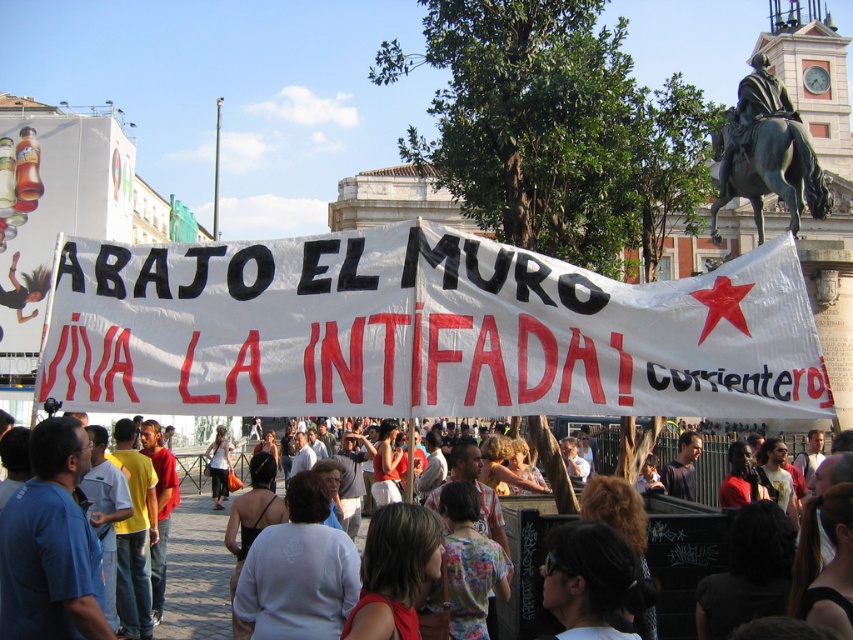
Question: Can you confirm if white cotton shirt at center is positioned to the right of bronze statue of man on horse at upper right?

Choices:
 (A) yes
 (B) no

Answer: (B)

Question: Can you confirm if white paper banner at center is positioned above bronze statue of man on horse at upper right?

Choices:
 (A) yes
 (B) no

Answer: (B)

Question: Which of the following is the farthest from the observer?

Choices:
 (A) white cotton shirt at center
 (B) bronze statue of man on horse at upper right
 (C) white paper banner at center

Answer: (B)

Question: Which point appears farthest from the camera in this image?

Choices:
 (A) (509, 532)
 (B) (477, 344)

Answer: (A)

Question: Which object is the closest to the white paper banner at center?

Choices:
 (A) bronze statue of man on horse at upper right
 (B) white cotton shirt at center

Answer: (B)

Question: Can you confirm if white cotton shirt at center is bigger than bronze statue of man on horse at upper right?

Choices:
 (A) yes
 (B) no

Answer: (B)